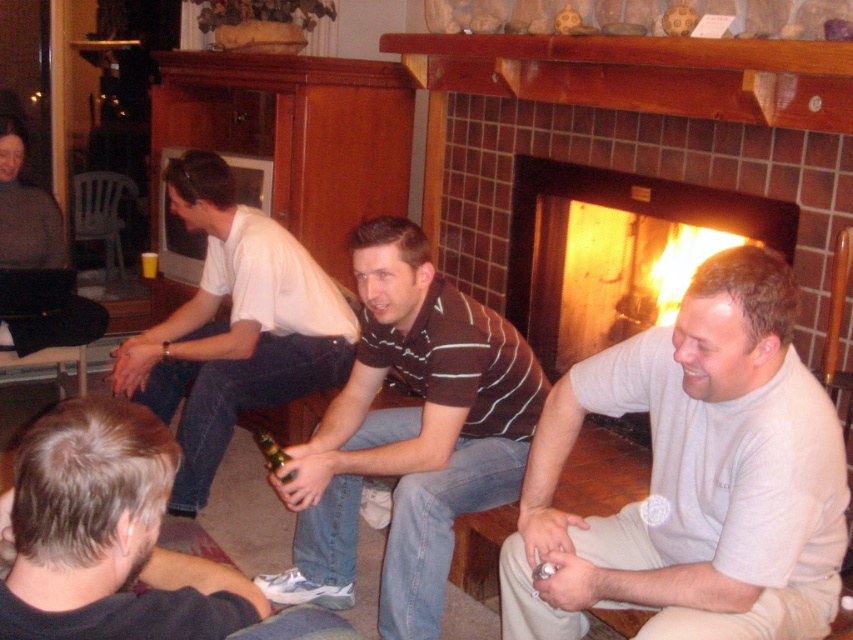
From the picture: Which is above, striped polo shirt at center or white cotton shirt at center?

white cotton shirt at center is above.

Is point (331, 582) more distant than point (309, 328)?

No, (331, 582) is closer to viewer.

Who is more forward, (456, 497) or (230, 337)?

Point (456, 497) is in front.

Locate an element on the screen. This screenshot has height=640, width=853. striped polo shirt at center is located at coordinates (408, 435).

Between point (622, 413) and point (796, 220), which one is positioned in front?

Point (622, 413)

Is point (659, 483) positioned in front of point (659, 243)?

Yes.

You are a GUI agent. You are given a task and a screenshot of the screen. Output one action in this format:
    pyautogui.click(x=<x>, y=<y>)
    Task: Click on the white turtleneck sweater at lower right
    
    Given the screenshot: What is the action you would take?
    pyautogui.click(x=694, y=477)

Is point (94, 522) more distant than point (224, 333)?

No.

Which is more to the left, denim jeans at lower left or white cotton shirt at center?

From the viewer's perspective, white cotton shirt at center appears more on the left side.

Identify the location of denim jeans at lower left. (107, 536).